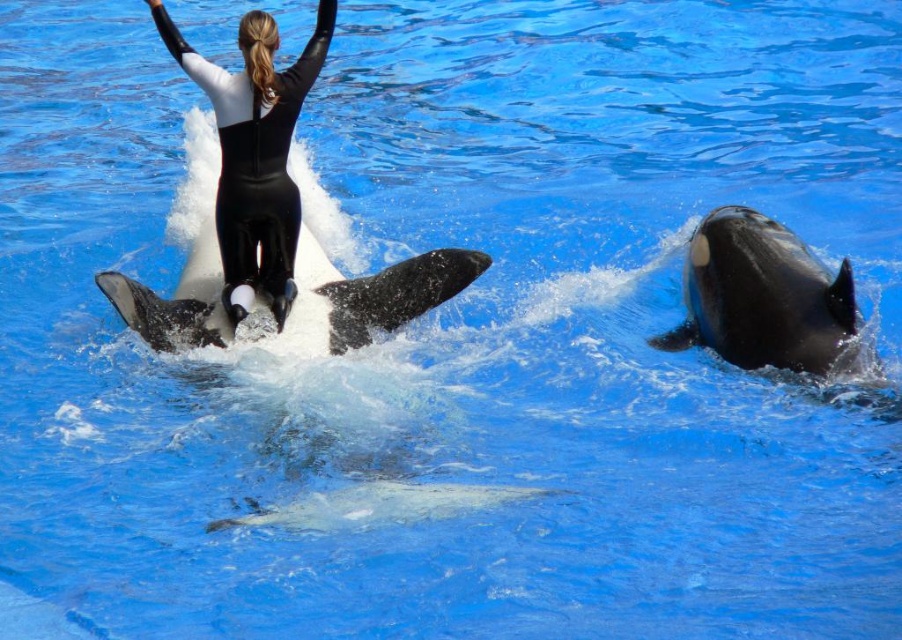
You are a marine biologist observing the orcas in the pool. You notice the black smooth whale at right and the black smooth dolphin at center. Which one has a more slender body shape?

The black smooth whale at right is thinner than the black smooth dolphin at center, so it has a more slender body shape.

You are a marine biologist observing the orcas in the pool. You notice two points marked in the scene. Which point is closer to your viewpoint? The points are located at coordinates point (684, 340) and point (244, 150).

Point (244, 150) is closer to your viewpoint because the description states that point (684, 340) is further away than point (244, 150).

You are a marine trainer standing at the edge of the pool. You need to throw a fish to both the black smooth whale at right and the black smooth dolphin at center. What is the minimum distance you need to throw the fish to reach both animals?

The minimum distance you need to throw the fish is 3.59 meters, as the black smooth whale at right and the black smooth dolphin at center are 3.59 meters apart from each other.